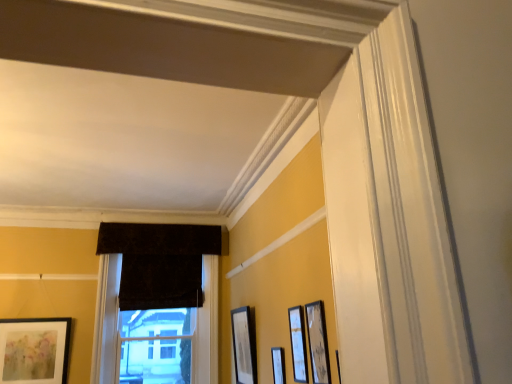
Question: In terms of size, does velvet dark brown window at center appear bigger or smaller than matte black picture frame at center, which is the 2th picture frame in left-to-right order?

Choices:
 (A) small
 (B) big

Answer: (B)

Question: Does point (183, 314) appear closer or farther from the camera than point (241, 362)?

Choices:
 (A) farther
 (B) closer

Answer: (A)

Question: Based on their relative distances, which object is farther from the wooden picture frame at right, the first picture frame when ordered from front to back?

Choices:
 (A) velvet dark brown window at center
 (B) matte black picture frame at lower right, the third picture frame in the right-to-left sequence
 (C) matte black picture frame at center, the 4th picture frame when ordered from left to right
 (D) matte black picture frame at center, which is counted as the fourth picture frame, starting from the right
 (E) matte black picture frame at lower left, the 1th picture frame positioned from the back

Answer: (E)

Question: Estimate the real-world distances between objects in this image. Which object is farther from the dark velvet curtain at center?

Choices:
 (A) matte black picture frame at center, acting as the second picture frame starting from the front
 (B) matte black picture frame at lower left, arranged as the fifth picture frame when viewed from the right
 (C) velvet dark brown window at center
 (D) matte black picture frame at center, the 4th picture frame in the front-to-back sequence
 (E) wooden picture frame at right, positioned as the 5th picture frame in left-to-right order

Answer: (E)